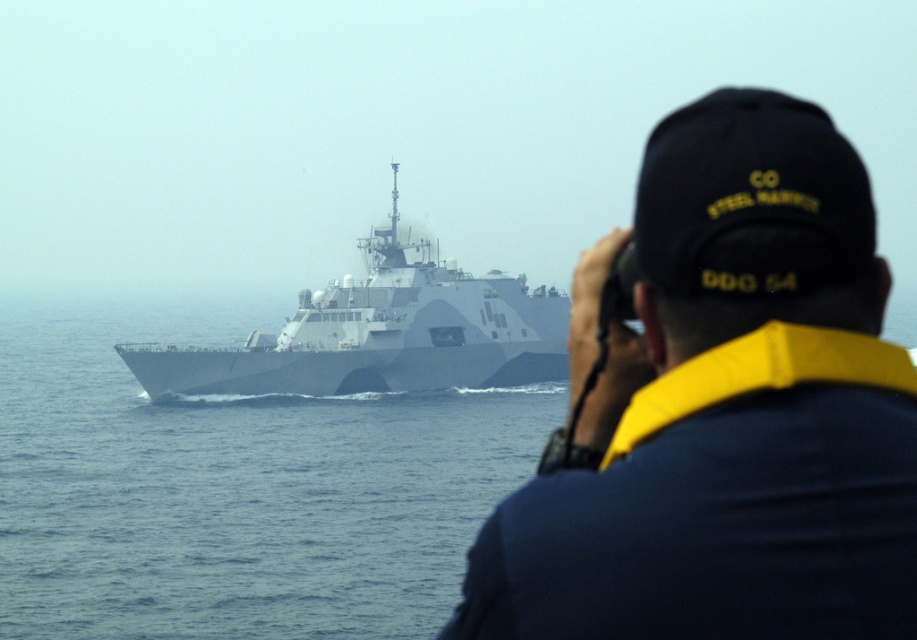
Question: Among these objects, which one is nearest to the camera?

Choices:
 (A) gray matte water at center
 (B) navy blue uniform at upper right
 (C) gray matte ship at center

Answer: (B)

Question: Where is gray matte water at center located in relation to gray matte ship at center in the image?

Choices:
 (A) above
 (B) below

Answer: (B)

Question: Which object is the closest to the gray matte ship at center?

Choices:
 (A) gray matte water at center
 (B) navy blue uniform at upper right

Answer: (A)

Question: Can you confirm if navy blue uniform at upper right is positioned to the left of gray matte ship at center?

Choices:
 (A) no
 (B) yes

Answer: (A)

Question: Is navy blue uniform at upper right smaller than gray matte water at center?

Choices:
 (A) yes
 (B) no

Answer: (A)

Question: Which point appears closest to the camera in this image?

Choices:
 (A) (481, 365)
 (B) (236, 541)

Answer: (B)